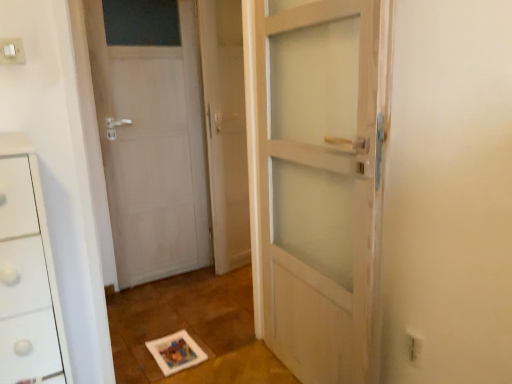
Question: Is white plastic electric outlet at upper left, the second electric outlet viewed from the right, not inside clear glass screen door at center?

Choices:
 (A) yes
 (B) no

Answer: (A)

Question: Does white plastic electric outlet at upper left, the 1th electric outlet positioned from the left, turn towards clear glass screen door at center?

Choices:
 (A) no
 (B) yes

Answer: (A)

Question: Is white plastic electric outlet at upper left, the second electric outlet viewed from the right, touching clear glass screen door at center?

Choices:
 (A) no
 (B) yes

Answer: (A)

Question: Considering the relative positions of white plastic electric outlet at upper left, the 1th electric outlet positioned from the left, and clear glass screen door at center in the image provided, is white plastic electric outlet at upper left, the 1th electric outlet positioned from the left, to the left of clear glass screen door at center from the viewer's perspective?

Choices:
 (A) yes
 (B) no

Answer: (A)

Question: From a real-world perspective, is white plastic electric outlet at upper left, the second electric outlet viewed from the right, on clear glass screen door at center?

Choices:
 (A) no
 (B) yes

Answer: (B)

Question: Considering their positions, is white plastic electric outlet at lower right, the 2th electric outlet when ordered from top to bottom, located in front of or behind clear glass screen door at center?

Choices:
 (A) behind
 (B) front

Answer: (B)

Question: Is white plastic electric outlet at lower right, which is the first electric outlet from right to left, taller or shorter than clear glass screen door at center?

Choices:
 (A) short
 (B) tall

Answer: (A)

Question: Is white plastic electric outlet at lower right, which ranks as the first electric outlet in bottom-to-top order, wider or thinner than clear glass screen door at center?

Choices:
 (A) wide
 (B) thin

Answer: (B)

Question: From a real-world perspective, is white plastic electric outlet at lower right, the 2th electric outlet when ordered from top to bottom, positioned above or below clear glass screen door at center?

Choices:
 (A) below
 (B) above

Answer: (A)

Question: Is point (212, 77) closer or farther from the camera than point (415, 345)?

Choices:
 (A) farther
 (B) closer

Answer: (A)

Question: Based on their sizes in the image, would you say clear glass screen door at center is bigger or smaller than white plastic electric outlet at lower right, which is the first electric outlet from right to left?

Choices:
 (A) big
 (B) small

Answer: (A)

Question: From the image's perspective, is clear glass screen door at center above or below white plastic electric outlet at lower right, which is the first electric outlet from right to left?

Choices:
 (A) below
 (B) above

Answer: (B)

Question: Is clear glass screen door at center spatially inside white plastic electric outlet at lower right, which ranks as the first electric outlet in bottom-to-top order, or outside of it?

Choices:
 (A) inside
 (B) outside

Answer: (B)

Question: In the image, is white plastic electric outlet at lower right, which is the first electric outlet from right to left, on the left side or the right side of white matte door at left?

Choices:
 (A) left
 (B) right

Answer: (B)

Question: Based on their sizes in the image, would you say white plastic electric outlet at lower right, the 2th electric outlet when ordered from top to bottom, is bigger or smaller than white matte door at left?

Choices:
 (A) small
 (B) big

Answer: (A)